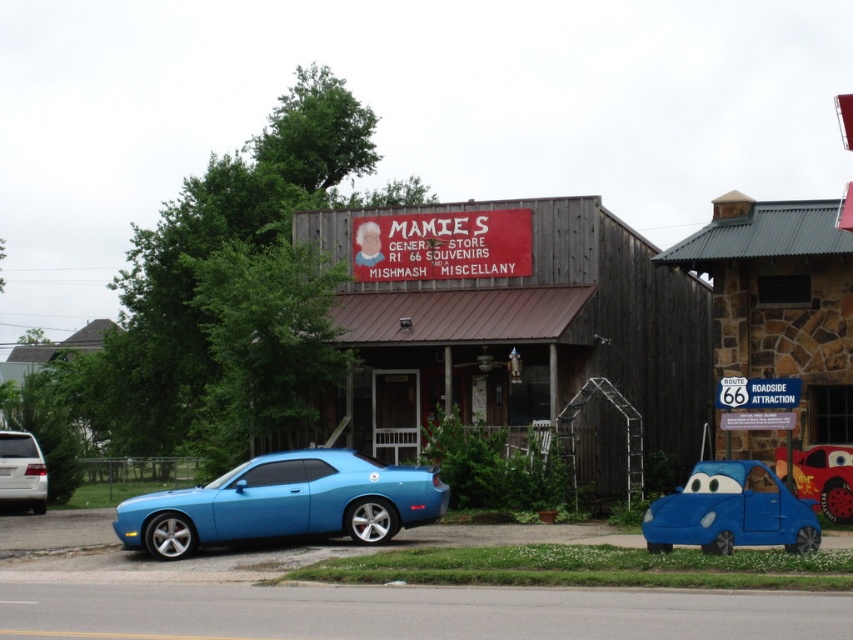
Can you confirm if wooden signboard at center is positioned above matte blue car at center?

Yes.

Who is higher up, wooden signboard at center or matte blue car at center?

wooden signboard at center is above.

Who is more forward, (398, 310) or (796, 486)?

Point (796, 486)

The width and height of the screenshot is (853, 640). I want to click on wooden signboard at center, so click(x=514, y=333).

Looking at this image, between matte blue car at lower left and blue matte car at center, which one appears on the right side from the viewer's perspective?

blue matte car at center

Is matte blue car at lower left smaller than blue matte car at center?

Actually, matte blue car at lower left might be larger than blue matte car at center.

Is point (228, 497) more distant than point (718, 548)?

Yes, point (228, 497) is farther from viewer.

This screenshot has height=640, width=853. Identify the location of matte blue car at lower left. (285, 502).

Between blue matte car at center and white matte van at left, which one appears on the right side from the viewer's perspective?

blue matte car at center is more to the right.

Does blue matte car at center have a larger size compared to white matte van at left?

Correct, blue matte car at center is larger in size than white matte van at left.

I want to click on blue matte car at center, so click(x=730, y=512).

The image size is (853, 640). In order to click on blue matte car at center in this screenshot , I will do [730, 512].